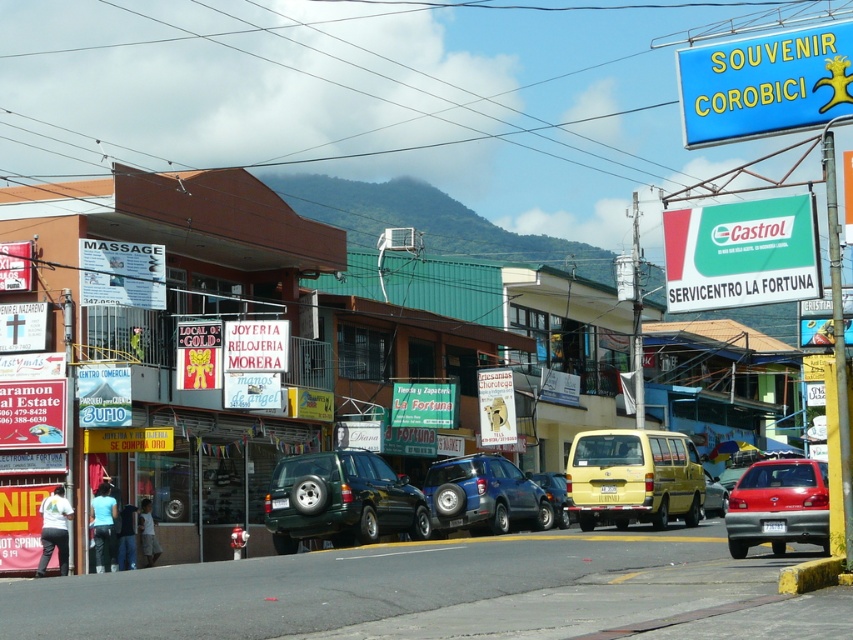
Does green matte suv at center have a lesser width compared to yellow matte van at center?

No, green matte suv at center is not thinner than yellow matte van at center.

Can you confirm if green matte suv at center is smaller than yellow matte van at center?

No.

Who is more forward, (381, 461) or (590, 516)?

Point (381, 461) is in front.

Where is `green matte suv at center`? green matte suv at center is located at coordinates (340, 500).

Between yellow matte van at center and metallic red car at lower right, which one is positioned lower?

metallic red car at lower right is lower down.

Who is positioned more to the left, yellow matte van at center or metallic red car at lower right?

yellow matte van at center

Does point (585, 461) come closer to viewer compared to point (819, 465)?

No, (585, 461) is further to viewer.

Locate an element on the screen. The image size is (853, 640). yellow matte van at center is located at coordinates (633, 477).

Can you confirm if matte black suv at center is positioned above green plastic sign at upper right?

No, matte black suv at center is not above green plastic sign at upper right.

Is point (73, 256) farther from camera compared to point (802, 221)?

Yes, it is behind point (802, 221).

What do you see at coordinates (184, 336) in the screenshot?
I see `matte black suv at center` at bounding box center [184, 336].

Locate an element on the screen. Image resolution: width=853 pixels, height=640 pixels. matte black suv at center is located at coordinates (184, 336).